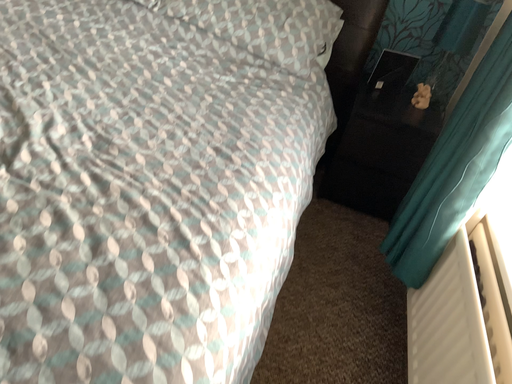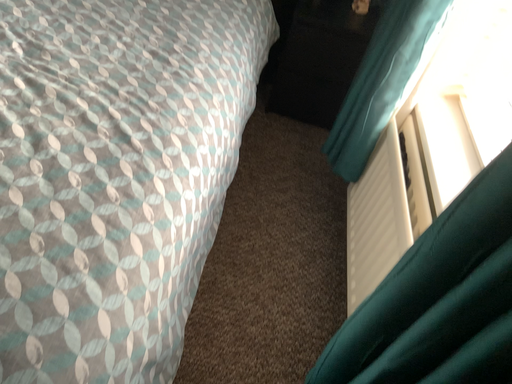
Question: How did the camera likely rotate when shooting the video?

Choices:
 (A) rotated upward
 (B) rotated downward

Answer: (B)